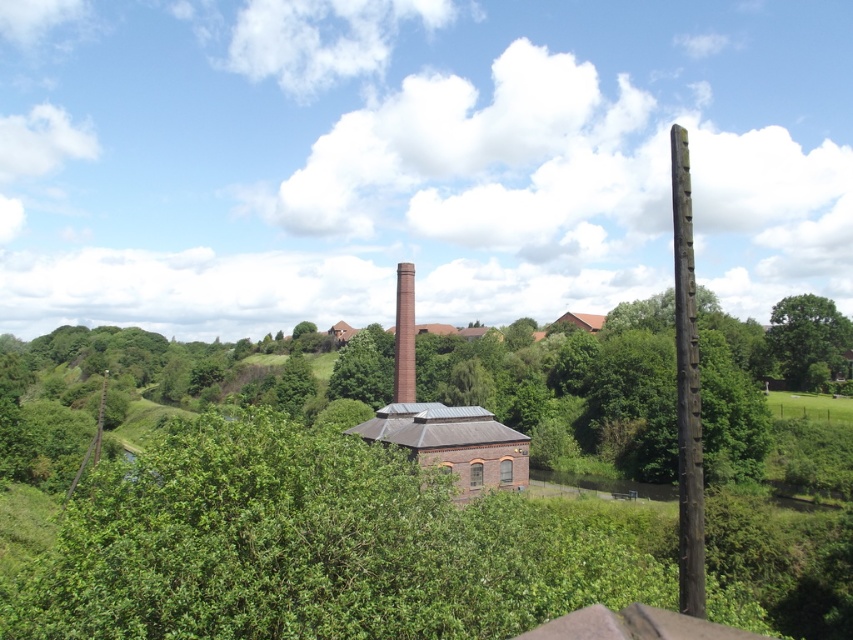
You are standing at the center of the historic brick structure and want to locate the green leafy tree at right. According to the coordinates provided, in which direction should you look to see it?

The green leafy tree at right is located at coordinates point (807, 339), which means it is positioned to the right side of the scene. Therefore, you should look to your right to see it.

You are a hiker standing at the edge of the forest looking towards the historic brick building. You notice a brown wooden pole at right and a green leafy tree at center. Which object is closer to you?

The brown wooden pole at right is closer to you as it is positioned in front of the green leafy tree at center.